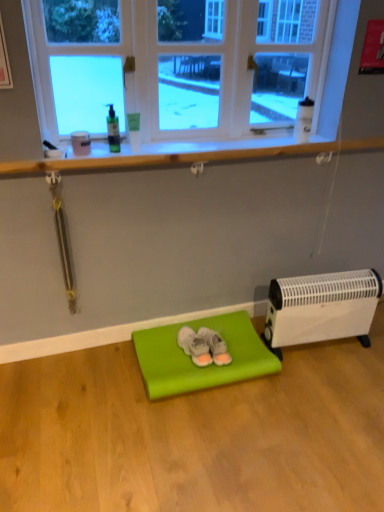
Question: Is gray suede slippers at center, acting as the 1th footwear starting from the left, smaller than clear glass window at upper center?

Choices:
 (A) no
 (B) yes

Answer: (B)

Question: Is gray suede slippers at center, acting as the 2th footwear starting from the right, in front of clear glass window at upper center?

Choices:
 (A) no
 (B) yes

Answer: (A)

Question: Is gray suede slippers at center, acting as the 1th footwear starting from the left, wider than clear glass window at upper center?

Choices:
 (A) no
 (B) yes

Answer: (B)

Question: From the image's perspective, would you say gray suede slippers at center, acting as the 1th footwear starting from the left, is positioned over clear glass window at upper center?

Choices:
 (A) yes
 (B) no

Answer: (B)

Question: From the image's perspective, is gray suede slippers at center, acting as the 2th footwear starting from the right, located beneath clear glass window at upper center?

Choices:
 (A) no
 (B) yes

Answer: (B)

Question: From a real-world perspective, is gray suede slippers at center, acting as the 1th footwear starting from the left, located beneath clear glass window at upper center?

Choices:
 (A) no
 (B) yes

Answer: (B)

Question: Can you confirm if matte green yoga mat at center is wider than gray suede slippers at center, acting as the 1th footwear starting from the left?

Choices:
 (A) yes
 (B) no

Answer: (A)

Question: From a real-world perspective, is matte green yoga mat at center located higher than gray suede slippers at center, acting as the 2th footwear starting from the right?

Choices:
 (A) no
 (B) yes

Answer: (A)

Question: Can you confirm if matte green yoga mat at center is bigger than gray suede slippers at center, acting as the 1th footwear starting from the left?

Choices:
 (A) no
 (B) yes

Answer: (B)

Question: Can you confirm if matte green yoga mat at center is taller than gray suede slippers at center, acting as the 2th footwear starting from the right?

Choices:
 (A) yes
 (B) no

Answer: (B)

Question: Is matte green yoga mat at center not near gray suede slippers at center, acting as the 1th footwear starting from the left?

Choices:
 (A) yes
 (B) no

Answer: (B)

Question: Can you confirm if matte green yoga mat at center is thinner than gray suede slippers at center, acting as the 2th footwear starting from the right?

Choices:
 (A) yes
 (B) no

Answer: (B)

Question: Does gray suede slippers at center, acting as the 1th footwear starting from the left, appear on the right side of white plastic heater at lower right?

Choices:
 (A) no
 (B) yes

Answer: (A)